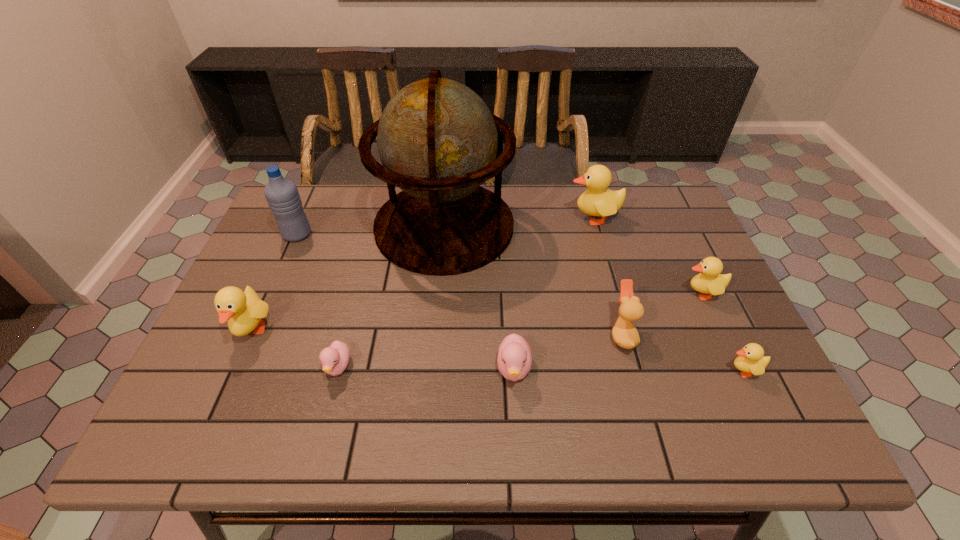
This screenshot has width=960, height=540. What are the coordinates of `blank area located 0.180m on the front-facing side of the nearest yellow duckling` in the screenshot? It's located at (643, 371).

I want to click on free spot located 0.090m on the front-facing side of the smaller pink duckling, so click(x=324, y=425).

Locate an element on the screen. The image size is (960, 540). globe at the far edge is located at coordinates (437, 140).

Image resolution: width=960 pixels, height=540 pixels. I want to click on water bottle that is at the far edge, so click(282, 195).

Find the location of a particular element. duckling that is at the far edge is located at coordinates (597, 200).

Locate an element on the screen. The image size is (960, 540). water bottle situated at the left edge is located at coordinates (282, 195).

Locate an element on the screen. duckling at the left edge is located at coordinates (244, 310).

Where is `object located at the far left corner`? object located at the far left corner is located at coordinates (282, 195).

Locate an element on the screen. Image resolution: width=960 pixels, height=540 pixels. vacant space at the near edge is located at coordinates (425, 446).

The width and height of the screenshot is (960, 540). In the image, there is a desktop. What are the coordinates of `vacant space at the left edge` in the screenshot? It's located at (272, 278).